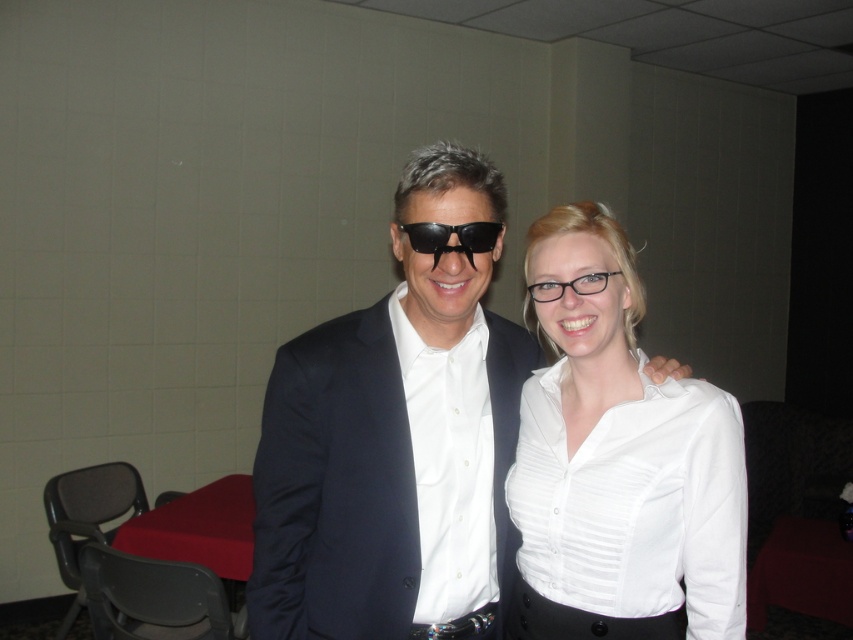
Who is lower down, white glossy shirt at center or satin black suit at center?

satin black suit at center is below.

Is point (572, 618) in front of point (277, 538)?

That is True.

Image resolution: width=853 pixels, height=640 pixels. Find the location of `white glossy shirt at center`. white glossy shirt at center is located at coordinates (618, 461).

Between point (380, 349) and point (473, 227), which one is positioned behind?

The point (380, 349) is behind.

Is satin black suit at center further to camera compared to black plastic sunglasses at center?

Yes, it is behind black plastic sunglasses at center.

This screenshot has height=640, width=853. Identify the location of satin black suit at center. (334, 486).

Locate an element on the screen. This screenshot has height=640, width=853. satin black suit at center is located at coordinates (334, 486).

Does matte black suit at center appear under black plastic sunglasses at center?

Correct, matte black suit at center is located below black plastic sunglasses at center.

Who is taller, matte black suit at center or black plastic sunglasses at center?

With more height is matte black suit at center.

Find the location of a particular element. The image size is (853, 640). matte black suit at center is located at coordinates (395, 440).

This screenshot has width=853, height=640. Find the location of `matte black suit at center`. matte black suit at center is located at coordinates (395, 440).